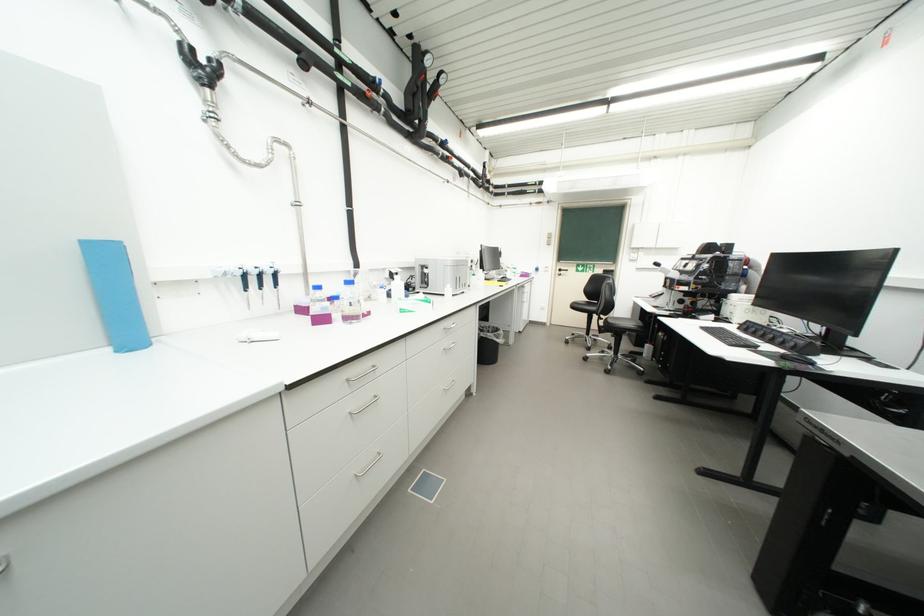
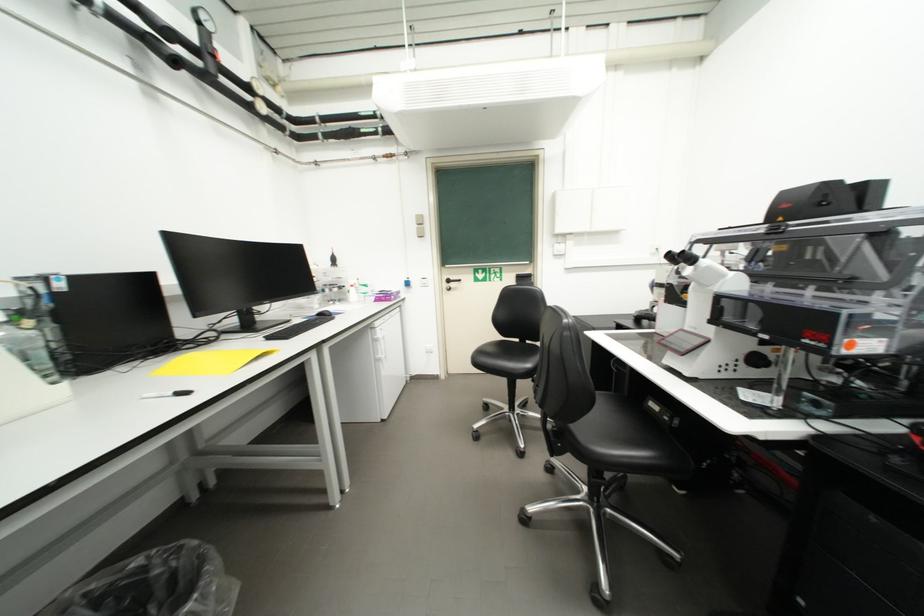
Where in the second image is the point corresponding to point (582, 308) from the first image?

(490, 362)